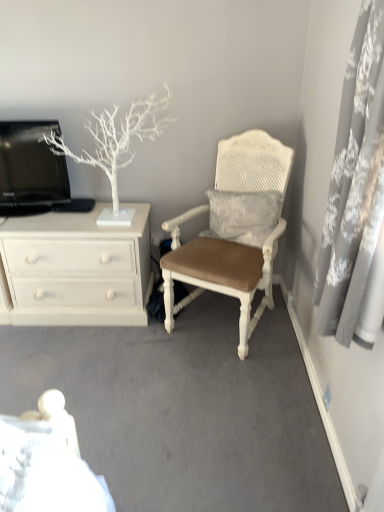
Question: Is the position of gray lace curtain at right more distant than that of white textured cushioned chair at center?

Choices:
 (A) no
 (B) yes

Answer: (A)

Question: Considering the relative sizes of gray lace curtain at right and white textured cushioned chair at center in the image provided, is gray lace curtain at right taller than white textured cushioned chair at center?

Choices:
 (A) yes
 (B) no

Answer: (B)

Question: Is white textured cushioned chair at center surrounded by gray lace curtain at right?

Choices:
 (A) no
 (B) yes

Answer: (A)

Question: Would you say gray lace curtain at right is outside white textured cushioned chair at center?

Choices:
 (A) yes
 (B) no

Answer: (A)

Question: Can you confirm if gray lace curtain at right is smaller than white textured cushioned chair at center?

Choices:
 (A) yes
 (B) no

Answer: (A)

Question: From the image's perspective, does gray lace curtain at right appear lower than white textured cushioned chair at center?

Choices:
 (A) yes
 (B) no

Answer: (B)

Question: From the image's perspective, does white painted wood chest of drawers at left appear higher than white matte tree at upper left?

Choices:
 (A) yes
 (B) no

Answer: (B)

Question: From a real-world perspective, is white painted wood chest of drawers at left positioned over white matte tree at upper left based on gravity?

Choices:
 (A) no
 (B) yes

Answer: (A)

Question: Would you say white matte tree at upper left is part of white painted wood chest of drawers at left's contents?

Choices:
 (A) no
 (B) yes

Answer: (A)

Question: Is white painted wood chest of drawers at left to the left of white matte tree at upper left from the viewer's perspective?

Choices:
 (A) yes
 (B) no

Answer: (A)

Question: Does white painted wood chest of drawers at left turn towards white matte tree at upper left?

Choices:
 (A) yes
 (B) no

Answer: (B)

Question: Considering the relative sizes of white painted wood chest of drawers at left and white matte tree at upper left in the image provided, is white painted wood chest of drawers at left thinner than white matte tree at upper left?

Choices:
 (A) no
 (B) yes

Answer: (A)

Question: From the image's perspective, would you say white textured cushioned chair at center is positioned over white painted wood chest of drawers at left?

Choices:
 (A) no
 (B) yes

Answer: (B)